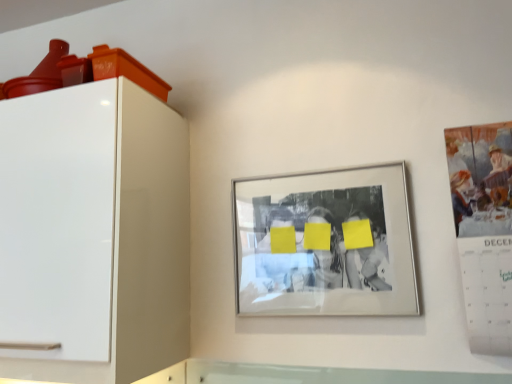
The width and height of the screenshot is (512, 384). Identify the location of silver metallic picture frame at center. (325, 243).

How much distance is there between white glossy cabinet at left and matte paper calendar at right?

A distance of 36.30 inches exists between white glossy cabinet at left and matte paper calendar at right.

Considering the relative sizes of white glossy cabinet at left and matte paper calendar at right in the image provided, is white glossy cabinet at left bigger than matte paper calendar at right?

Correct, white glossy cabinet at left is larger in size than matte paper calendar at right.

Looking at this image, which object is positioned more to the right, white glossy cabinet at left or matte paper calendar at right?

matte paper calendar at right is more to the right.

Can you tell me how much white glossy cabinet at left and matte paper calendar at right differ in facing direction?

0.403 degrees separate the facing orientations of white glossy cabinet at left and matte paper calendar at right.

From the image's perspective, between matte paper calendar at right and silver metallic picture frame at center, which one is located above?

matte paper calendar at right appears higher in the image.

From a real-world perspective, is matte paper calendar at right physically above silver metallic picture frame at center?

No.

Which object is thinner, matte paper calendar at right or silver metallic picture frame at center?

silver metallic picture frame at center is thinner.

In terms of size, does matte paper calendar at right appear bigger or smaller than silver metallic picture frame at center?

Considering their sizes, matte paper calendar at right takes up less space than silver metallic picture frame at center.

Find the location of `picture frame that is behind the matte paper calendar at right`. picture frame that is behind the matte paper calendar at right is located at coordinates (325, 243).

Consider the image. Is silver metallic picture frame at center situated inside matte paper calendar at right or outside?

silver metallic picture frame at center is located beyond the bounds of matte paper calendar at right.

Is silver metallic picture frame at center facing away from matte paper calendar at right?

That's not correct — silver metallic picture frame at center is not looking away from matte paper calendar at right.

From the picture: From their relative heights in the image, would you say silver metallic picture frame at center is taller or shorter than matte paper calendar at right?

silver metallic picture frame at center is shorter than matte paper calendar at right.

Is white glossy cabinet at left not inside silver metallic picture frame at center?

Indeed, white glossy cabinet at left is completely outside silver metallic picture frame at center.

Is white glossy cabinet at left oriented towards silver metallic picture frame at center?

No, white glossy cabinet at left does not turn towards silver metallic picture frame at center.

Considering the sizes of objects white glossy cabinet at left and silver metallic picture frame at center in the image provided, who is taller, white glossy cabinet at left or silver metallic picture frame at center?

white glossy cabinet at left.

Is white glossy cabinet at left in front of or behind silver metallic picture frame at center in the image?

white glossy cabinet at left is in front of silver metallic picture frame at center.

Based on the photo, considering the sizes of matte paper calendar at right and white glossy cabinet at left in the image, is matte paper calendar at right bigger or smaller than white glossy cabinet at left?

Considering their sizes, matte paper calendar at right takes up less space than white glossy cabinet at left.

From the image's perspective, would you say matte paper calendar at right is shown under white glossy cabinet at left?

Actually, matte paper calendar at right appears above white glossy cabinet at left in the image.

Considering the sizes of objects matte paper calendar at right and white glossy cabinet at left in the image provided, who is taller, matte paper calendar at right or white glossy cabinet at left?

With more height is white glossy cabinet at left.

Can you confirm if matte paper calendar at right is positioned to the left of white glossy cabinet at left?

In fact, matte paper calendar at right is to the right of white glossy cabinet at left.

Identify the location of furniture that appears on the left of silver metallic picture frame at center. The width and height of the screenshot is (512, 384). (102, 232).

What's the angular difference between silver metallic picture frame at center and white glossy cabinet at left's facing directions?

0.403 degrees.

Which of these two, silver metallic picture frame at center or white glossy cabinet at left, is bigger?

white glossy cabinet at left is bigger.

Does point (336, 267) come in front of point (112, 376)?

No, it is not.

Identify the location of furniture lying on the left of matte paper calendar at right. Image resolution: width=512 pixels, height=384 pixels. (102, 232).

Where is `picture frame behind the matte paper calendar at right`? The height and width of the screenshot is (384, 512). picture frame behind the matte paper calendar at right is located at coordinates (325, 243).

Estimate the real-world distances between objects in this image. Which object is further from silver metallic picture frame at center, matte paper calendar at right or white glossy cabinet at left?

white glossy cabinet at left is further to silver metallic picture frame at center.

Considering their positions, is matte paper calendar at right positioned further to white glossy cabinet at left than silver metallic picture frame at center?

matte paper calendar at right.

Estimate the real-world distances between objects in this image. Which object is closer to matte paper calendar at right, white glossy cabinet at left or silver metallic picture frame at center?

Based on the image, silver metallic picture frame at center appears to be nearer to matte paper calendar at right.

Considering their positions, is silver metallic picture frame at center positioned closer to white glossy cabinet at left than matte paper calendar at right?

Based on the image, silver metallic picture frame at center appears to be nearer to white glossy cabinet at left.

Estimate the real-world distances between objects in this image. Which object is further from silver metallic picture frame at center, white glossy cabinet at left or matte paper calendar at right?

The object further to silver metallic picture frame at center is white glossy cabinet at left.

When comparing their distances from matte paper calendar at right, does silver metallic picture frame at center or white glossy cabinet at left seem further?

white glossy cabinet at left.

Find the location of `picture frame between white glossy cabinet at left and matte paper calendar at right in the horizontal direction`. picture frame between white glossy cabinet at left and matte paper calendar at right in the horizontal direction is located at coordinates (325, 243).